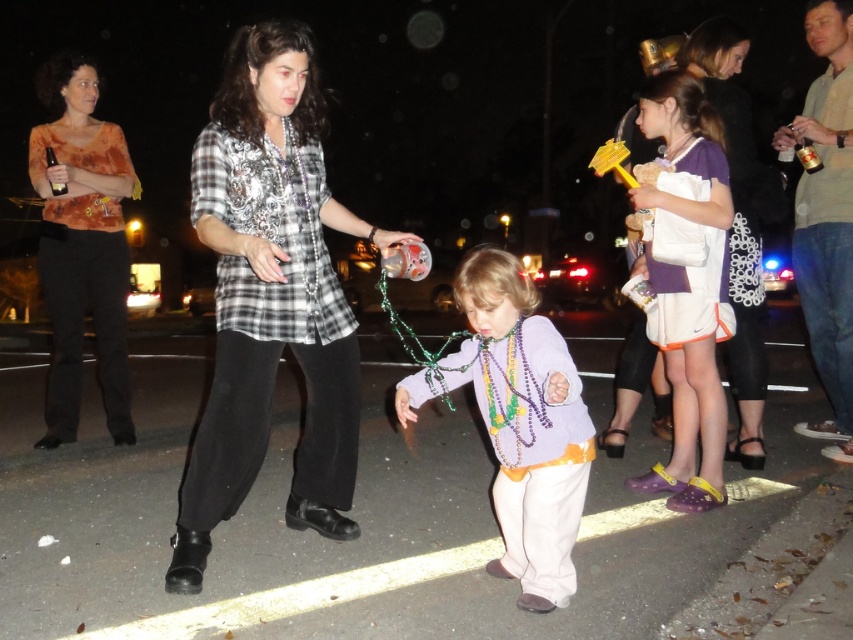
Question: Which object is farther from the camera taking this photo?

Choices:
 (A) orange floral shirt at left
 (B) plaid shirt at center

Answer: (A)

Question: Can you confirm if purple matte shirt at center is bigger than purple fabric shorts at right?

Choices:
 (A) no
 (B) yes

Answer: (B)

Question: Which object is closer to the camera taking this photo?

Choices:
 (A) plaid shirt at center
 (B) orange floral shirt at left

Answer: (A)

Question: Can you confirm if orange floral shirt at left is positioned to the right of purple fabric shorts at right?

Choices:
 (A) yes
 (B) no

Answer: (B)

Question: Which of the following is the closest to the observer?

Choices:
 (A) (113, 433)
 (B) (212, 502)
 (C) (556, 444)

Answer: (C)

Question: From the image, what is the correct spatial relationship of orange floral shirt at left in relation to purple fabric shorts at right?

Choices:
 (A) above
 (B) below

Answer: (A)